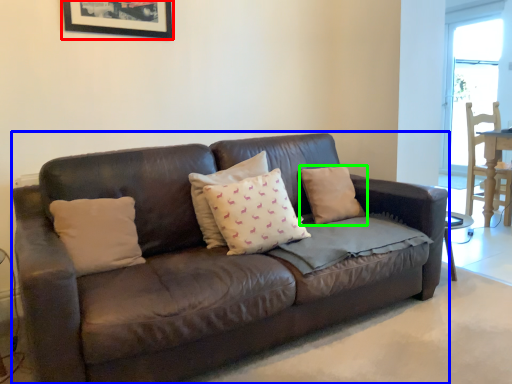
Question: Which object is the closest to the picture frame (highlighted by a red box)? Choose among these: studio couch (highlighted by a blue box) or pillow (highlighted by a green box).

Choices:
 (A) studio couch
 (B) pillow

Answer: (A)